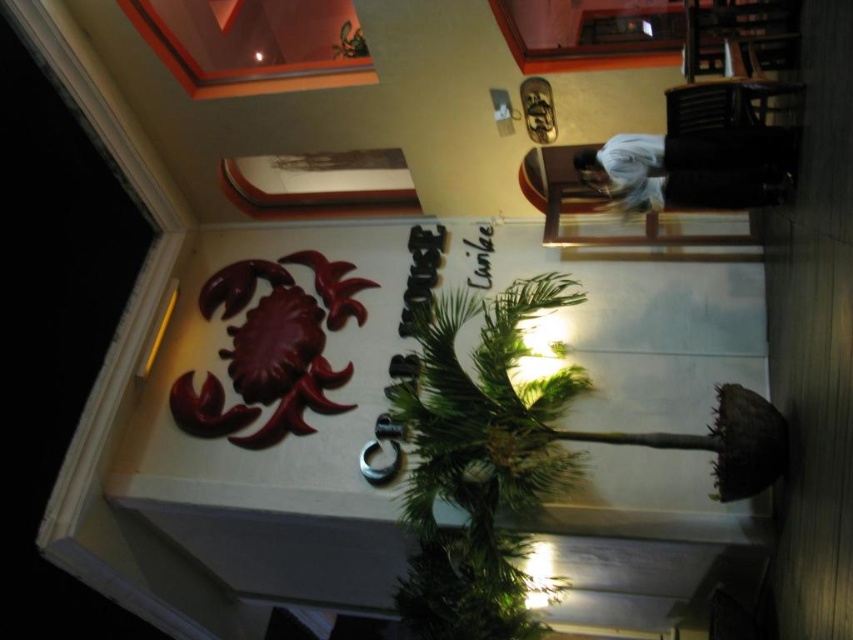
You are a customer entering the restaurant and notice the green leafy palm tree at center and the white cotton shirt at upper right. Which object is closer to you from your perspective?

The green leafy palm tree at center is closer to you because the white cotton shirt at upper right is behind it.

You are a customer entering the restaurant and see the green leafy palm tree at center and the white cotton shirt at upper right. Which object is positioned lower in the scene?

The green leafy palm tree at center is located below the white cotton shirt at upper right, so it is positioned lower in the scene.